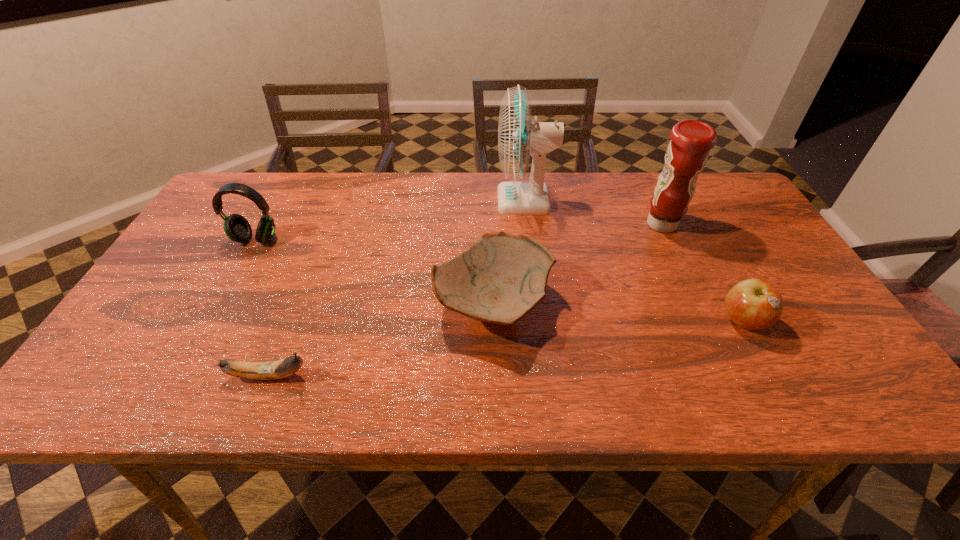
At what (x,y) coordinates should I click in order to perform the action: click on blank space located 0.270m in front of the fan to face the airflow. Please return your answer as a coordinate pair (x, y). The width and height of the screenshot is (960, 540). Looking at the image, I should click on (407, 200).

This screenshot has width=960, height=540. What are the coordinates of `vacant region located 0.120m on the right of the condiment` in the screenshot? It's located at (724, 225).

The height and width of the screenshot is (540, 960). In order to click on vacant area located 0.200m on the ear cups of the leftmost object in this screenshot , I will do `click(219, 306)`.

Find the location of a particular element. This screenshot has height=540, width=960. vacant space positioned on the right of the pottery is located at coordinates (609, 305).

Find the location of a particular element. The width and height of the screenshot is (960, 540). vacant space positioned on the back of the apple is located at coordinates (x=696, y=234).

The height and width of the screenshot is (540, 960). I want to click on vacant area situated 0.050m at the stem of the second object from left to right, so click(x=336, y=375).

This screenshot has height=540, width=960. In order to click on fan positioned at the far edge in this screenshot , I will do `click(519, 135)`.

Where is `condiment present at the far edge`? The image size is (960, 540). condiment present at the far edge is located at coordinates (691, 140).

This screenshot has height=540, width=960. What are the coordinates of `object situated at the near edge` in the screenshot? It's located at (x=269, y=370).

This screenshot has height=540, width=960. What are the coordinates of `object that is at the left edge` in the screenshot? It's located at (237, 228).